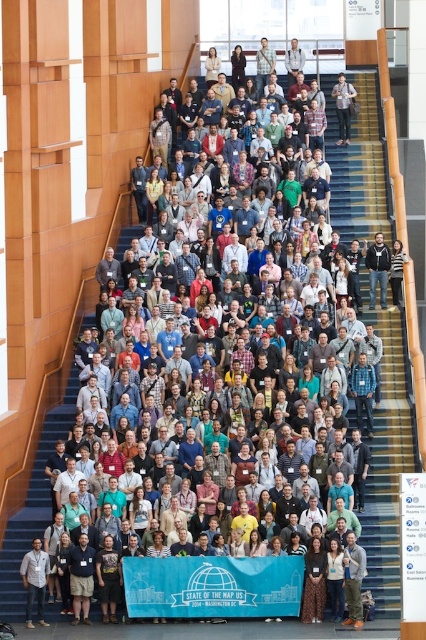
Question: Which point is farther from the camera taking this photo?

Choices:
 (A) (258, 68)
 (B) (36, 570)
 (C) (339, 88)
 (D) (301, 58)

Answer: (D)

Question: Is gray knit sweater at center bigger than dark gray hoodie at center?

Choices:
 (A) yes
 (B) no

Answer: (B)

Question: Does matte black jacket at center appear on the left side of denim jacket at center?

Choices:
 (A) no
 (B) yes

Answer: (A)

Question: Can you confirm if gray knit sweater at center is positioned below dark gray hoodie at center?

Choices:
 (A) no
 (B) yes

Answer: (B)

Question: Among these objects, which one is nearest to the camera?

Choices:
 (A) gray knit sweater at center
 (B) matte black backpack at upper center

Answer: (A)

Question: Based on their relative distances, which object is farther from the light gray shirt at upper center?

Choices:
 (A) denim jacket at center
 (B) matte black jacket at center

Answer: (B)